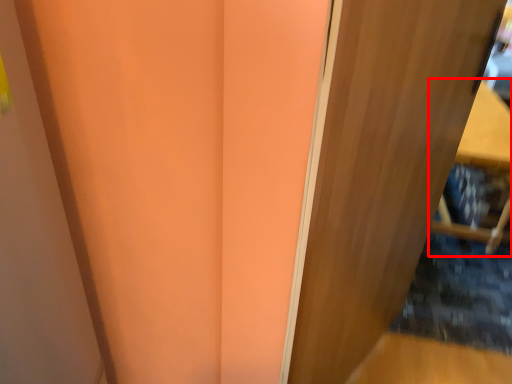
Question: From the image's perspective, considering the relative positions of furniture (annotated by the red box) and door in the image provided, where is furniture (annotated by the red box) located with respect to the staircase?

Choices:
 (A) below
 (B) above

Answer: (B)